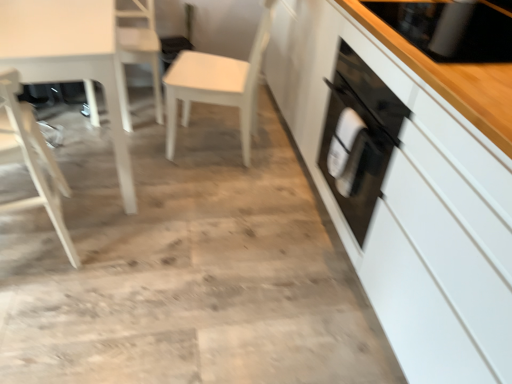
Where is `vacant area that lies between white wood chair at left, positioned as the first chair in left-to-right order, and white glossy table at left`? vacant area that lies between white wood chair at left, positioned as the first chair in left-to-right order, and white glossy table at left is located at coordinates (101, 232).